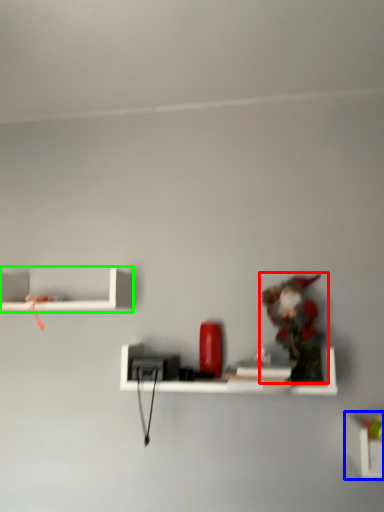
Question: Which is farther away from toy (highlighted by a red box)? shelf (highlighted by a blue box) or shelf (highlighted by a green box)?

Choices:
 (A) shelf
 (B) shelf

Answer: (B)